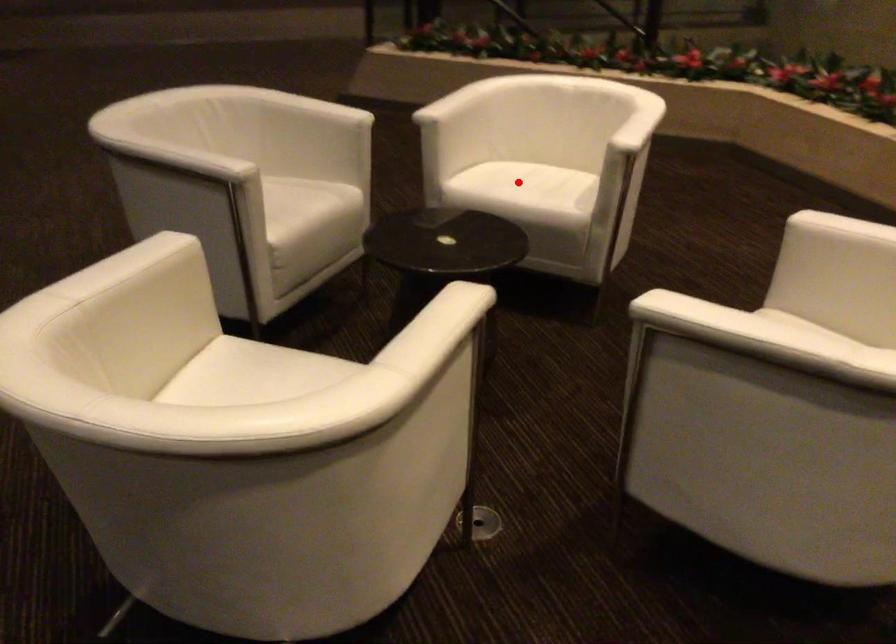
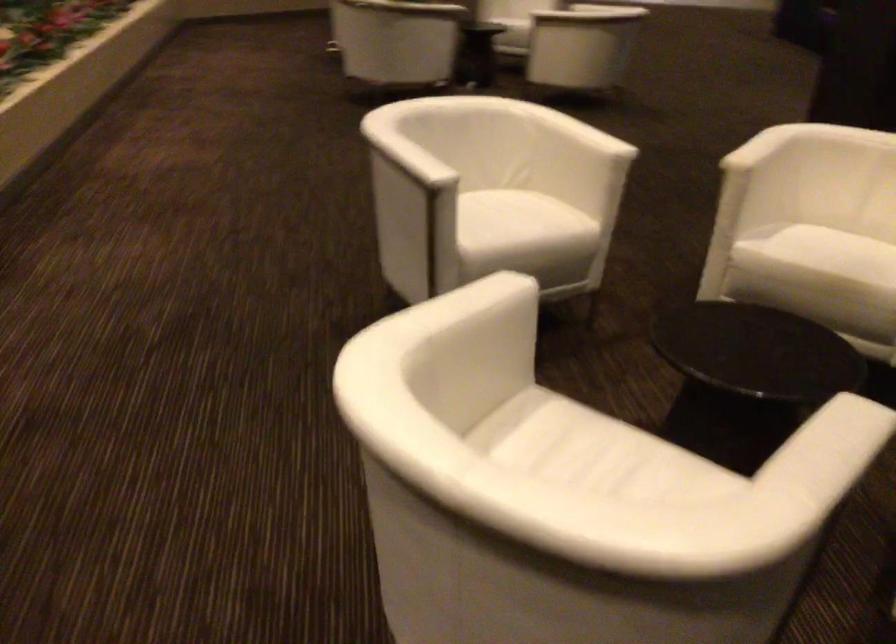
Question: I am providing you with two images of the same scene from different viewpoints. Image1 has a red point marked. In image2, the corresponding 3D location appears at what relative position? Reply with the corresponding letter.

Choices:
 (A) Closer
 (B) Farther

Answer: (A)